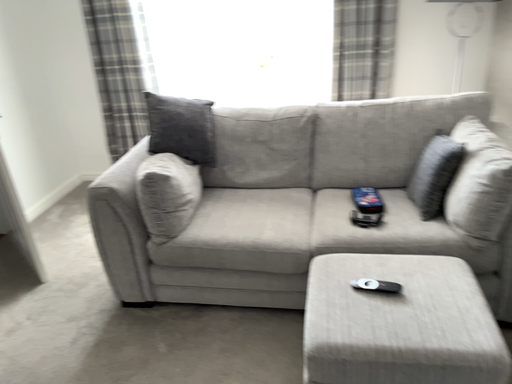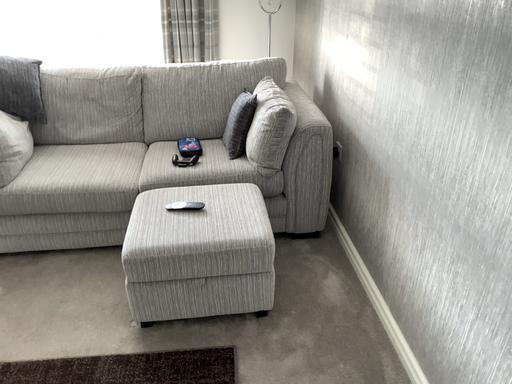
Question: Which way did the camera rotate in the video?

Choices:
 (A) rotated left
 (B) rotated right

Answer: (B)